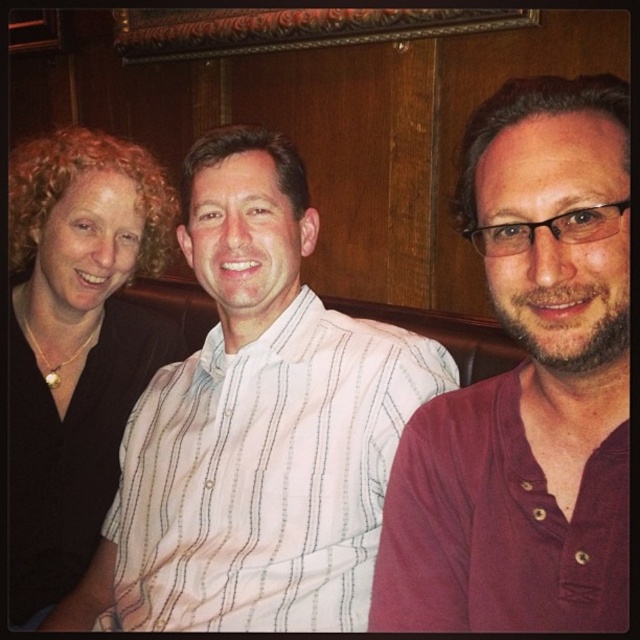
Question: Which object is the farthest from the white striped shirt at center?

Choices:
 (A) maroon cotton shirt at right
 (B) black matte shirt at left

Answer: (A)

Question: Where is maroon cotton shirt at right located in relation to black matte shirt at left in the image?

Choices:
 (A) right
 (B) left

Answer: (A)

Question: From the image, what is the correct spatial relationship of white striped shirt at center in relation to black matte shirt at left?

Choices:
 (A) right
 (B) left

Answer: (A)

Question: Which of the following is the closest to the observer?

Choices:
 (A) (138, 164)
 (B) (572, 340)

Answer: (B)

Question: Which object is farther from the camera taking this photo?

Choices:
 (A) black matte shirt at left
 (B) maroon cotton shirt at right

Answer: (A)

Question: Does white striped shirt at center appear on the left side of black matte shirt at left?

Choices:
 (A) no
 (B) yes

Answer: (A)